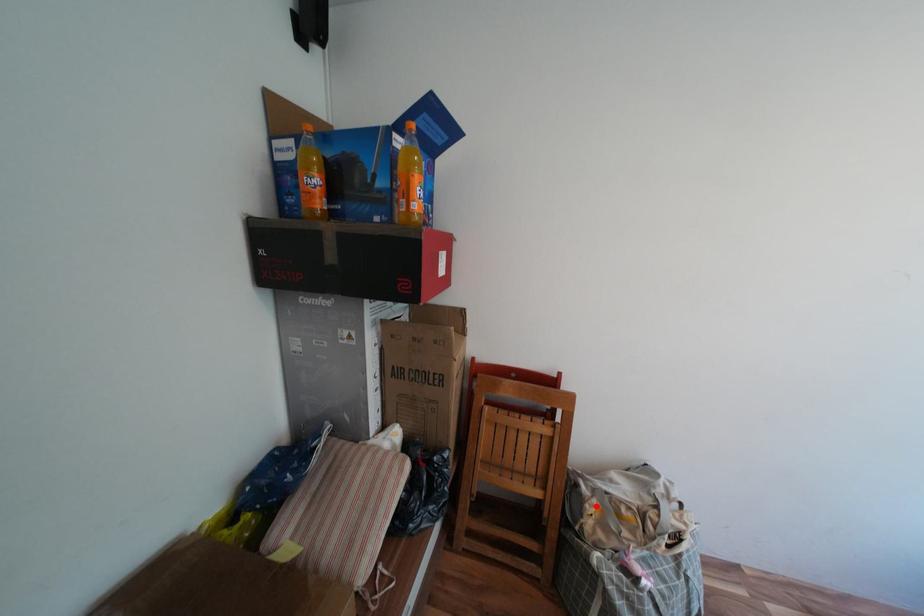
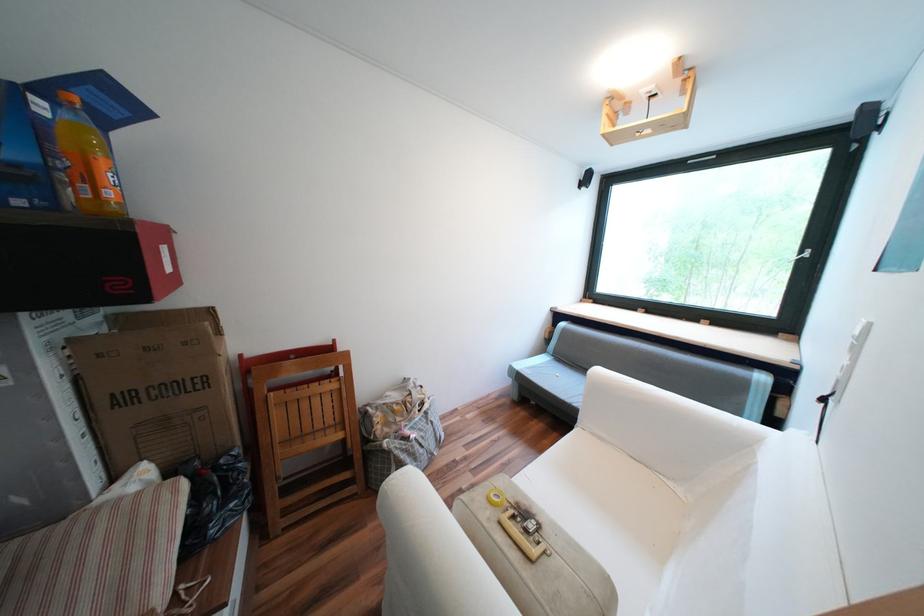
Find the pixel in the second image that matches the highlighted location in the first image.

(383, 419)